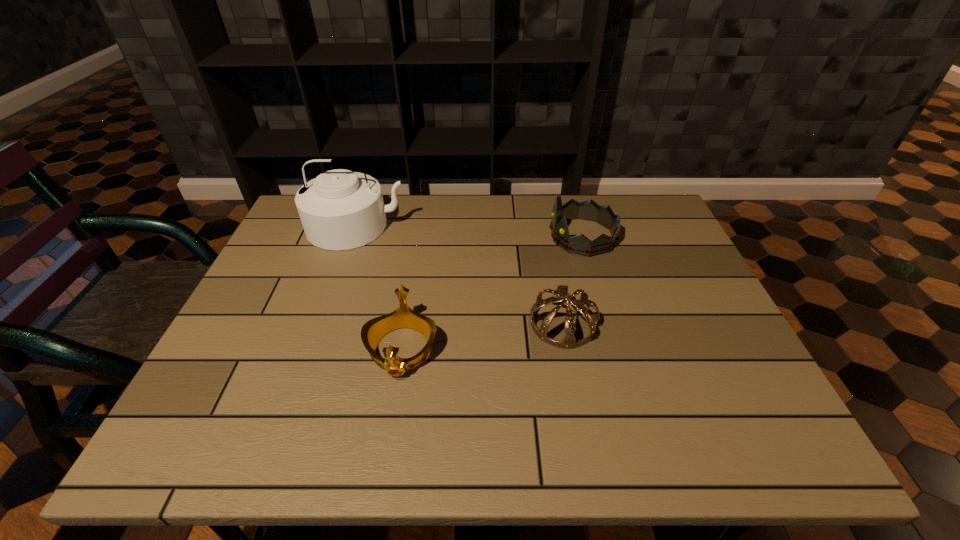
This screenshot has width=960, height=540. Identify the location of tiara positioned at the far edge. (589, 210).

Where is `object that is at the left edge`? Image resolution: width=960 pixels, height=540 pixels. object that is at the left edge is located at coordinates (339, 209).

The height and width of the screenshot is (540, 960). I want to click on object located in the far left corner section of the desktop, so click(339, 209).

In the image, there is a desktop. Where is `vacant space at the far edge`? vacant space at the far edge is located at coordinates (416, 230).

You are a GUI agent. You are given a task and a screenshot of the screen. Output one action in this format:
    pyautogui.click(x=<x>, y=<y>)
    Task: Click on the free region at the near edge of the desktop
    Image resolution: width=960 pixels, height=540 pixels.
    Given the screenshot: What is the action you would take?
    point(554,448)

In the image, there is a desktop. What are the coordinates of `free region at the left edge` in the screenshot? It's located at (291, 324).

Find the location of a particular element. The image size is (960, 540). free space at the right edge of the desktop is located at coordinates [631, 250].

I want to click on vacant space at the near left corner, so tap(258, 427).

In the image, there is a desktop. In order to click on blank space at the far right corner in this screenshot , I will do [x=648, y=201].

Identify the location of vacant space at the near right corner of the desktop. (779, 416).